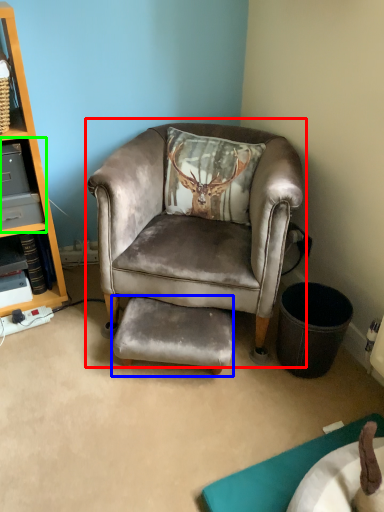
Question: Which is farther away from chair (highlighted by a red box)? footrest (highlighted by a blue box) or shelf (highlighted by a green box)?

Choices:
 (A) footrest
 (B) shelf

Answer: (B)